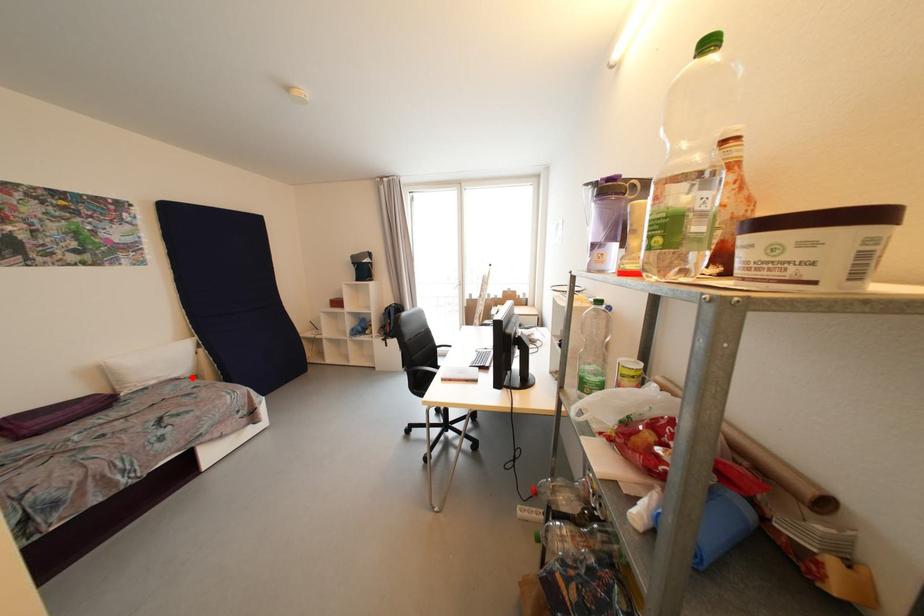
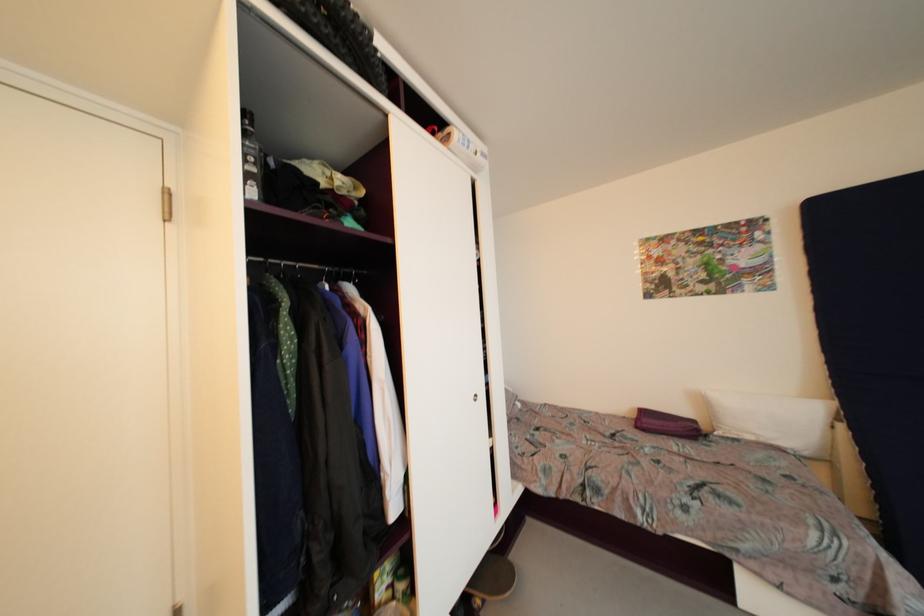
Locate, in the second image, the point that corresponds to the highlighted location in the first image.

(810, 456)